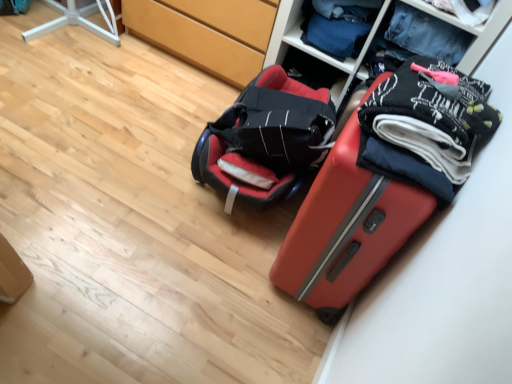
Identify the location of free location in front of matte red suitcase at lower right. The image size is (512, 384). (256, 334).